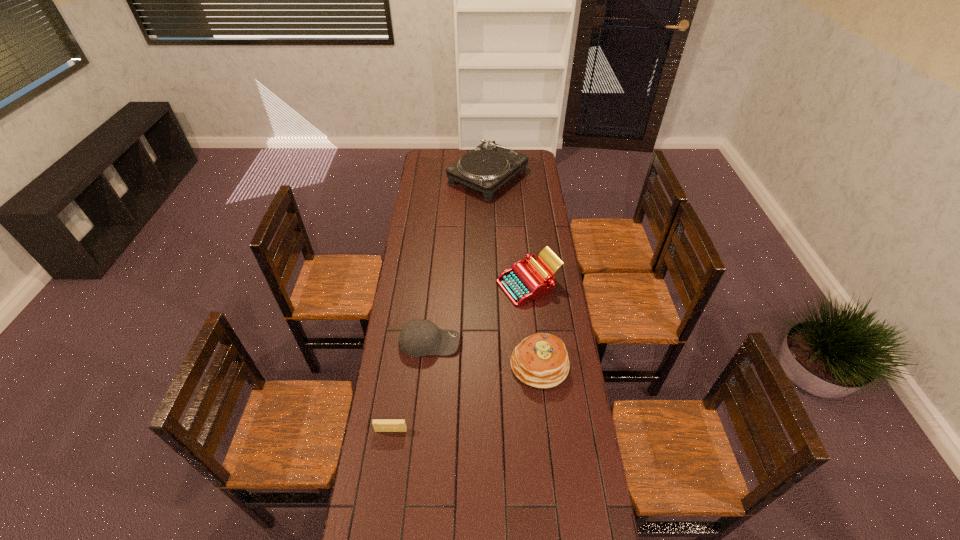
Where is `empty location between the baseball cap and the typewriter`? The height and width of the screenshot is (540, 960). empty location between the baseball cap and the typewriter is located at coordinates (479, 314).

Identify the location of empty space between the baseball cap and the typewriter. (479, 314).

The image size is (960, 540). What are the coordinates of `object that can be found as the fourth closest to the baseball cap` in the screenshot? It's located at (487, 167).

Select which object appears as the third closest to the record player. Please provide its 2D coordinates. Your answer should be formatted as a tuple, i.e. [(x, y)], where the tuple contains the x and y coordinates of a point satisfying the conditions above.

[(541, 360)]

Locate an element on the screen. The width and height of the screenshot is (960, 540). vacant position in the image that satisfies the following two spatial constraints: 1. on the back side of the pancake; 2. on the typing side of the fourth nearest object is located at coordinates (531, 285).

Where is `blank space that satisfies the following two spatial constraints: 1. on the typing side of the fourth nearest object; 2. at the front of the nearest object with spools`? The height and width of the screenshot is (540, 960). blank space that satisfies the following two spatial constraints: 1. on the typing side of the fourth nearest object; 2. at the front of the nearest object with spools is located at coordinates (543, 430).

Identify the location of free point that satisfies the following two spatial constraints: 1. on the back side of the pancake; 2. on the typing side of the second farthest object. The height and width of the screenshot is (540, 960). (531, 285).

The image size is (960, 540). I want to click on free point that satisfies the following two spatial constraints: 1. on the typing side of the second farthest object; 2. at the front of the videotape with spools, so 543,430.

Where is `free region that satisfies the following two spatial constraints: 1. on the typing side of the typewriter; 2. on the right side of the pancake`? free region that satisfies the following two spatial constraints: 1. on the typing side of the typewriter; 2. on the right side of the pancake is located at coordinates (537, 364).

The width and height of the screenshot is (960, 540). What are the coordinates of `vacant position in the image that satisfies the following two spatial constraints: 1. on the front brim of the baseball cap; 2. at the front of the nearest object with spools` in the screenshot? It's located at (421, 430).